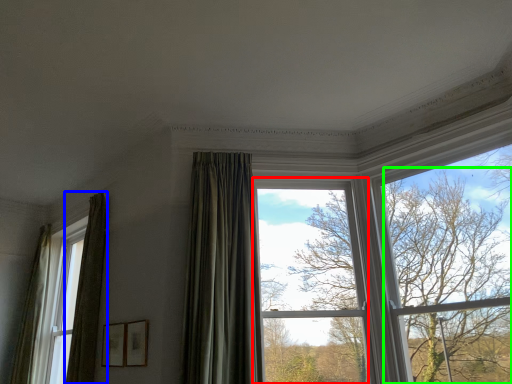
Question: Which is nearer to the window (highlighted by a red box)? curtain (highlighted by a blue box) or tree (highlighted by a green box).

Choices:
 (A) curtain
 (B) tree

Answer: (B)